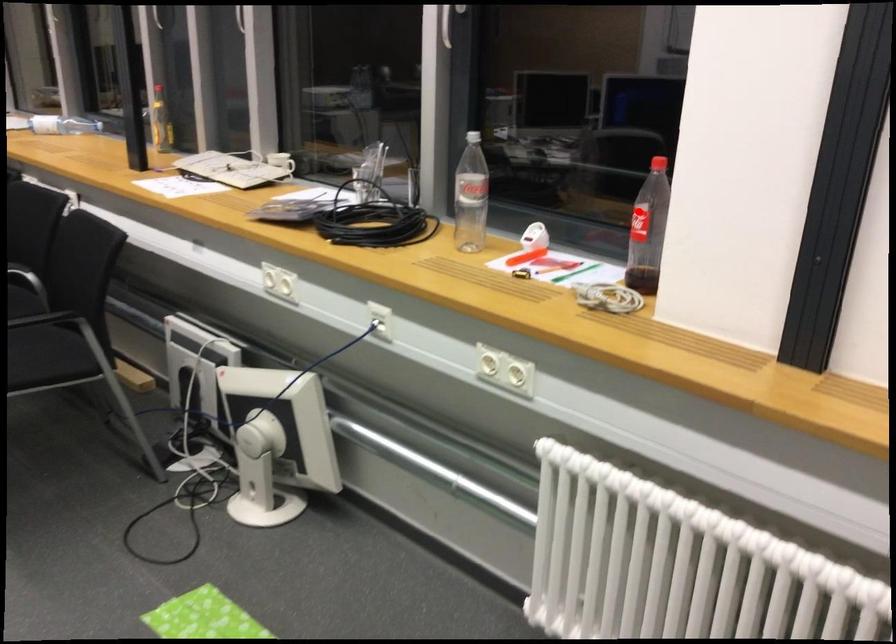
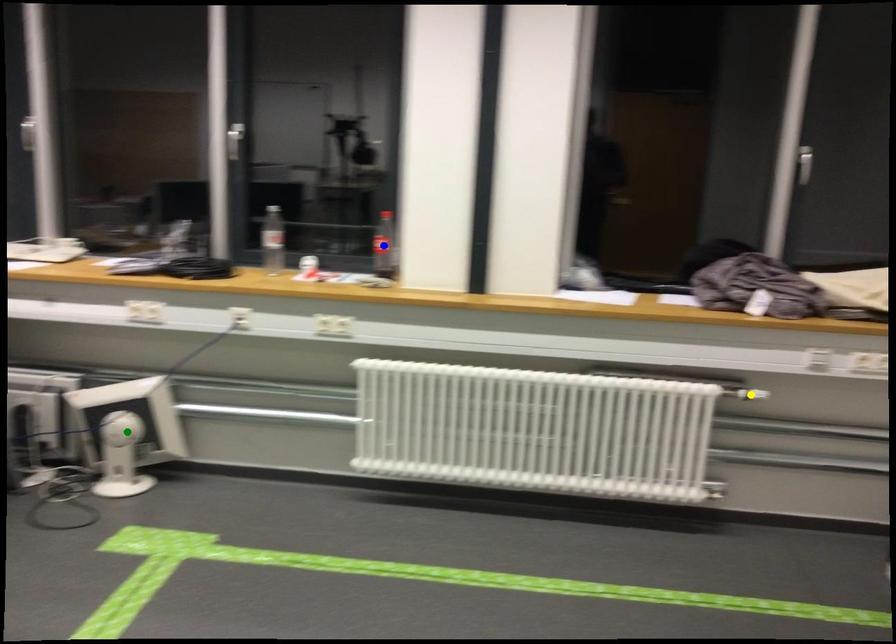
Question: I am providing you with two images of the same scene from different viewpoints. A red point is marked on the first image. You are given multiple points on the second image. Which mark in image 2 goes with the point in image 1?

Choices:
 (A) yellow point
 (B) blue point
 (C) green point

Answer: (B)